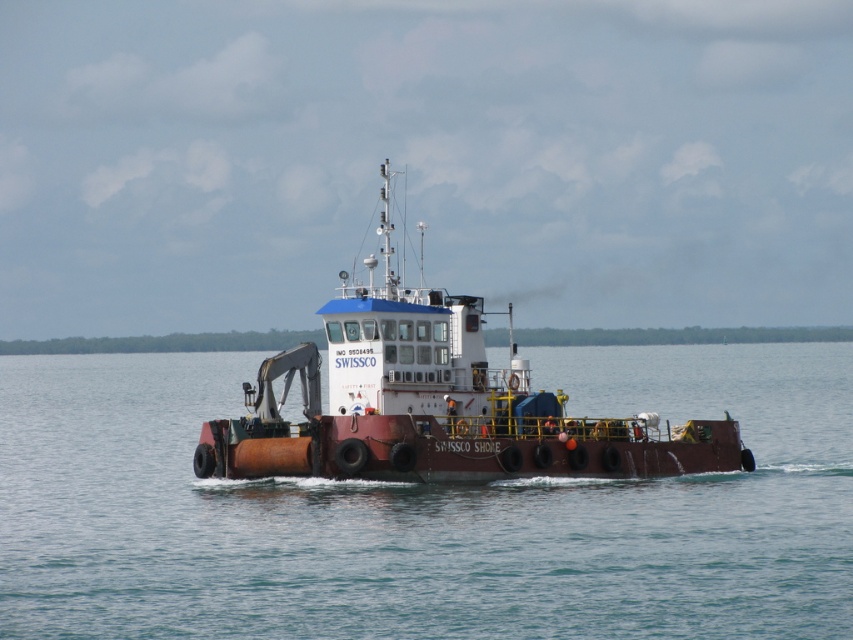
Is rusty metal water at center further to camera compared to rusty metal barge at center?

No, rusty metal water at center is in front of rusty metal barge at center.

Between rusty metal water at center and rusty metal barge at center, which one is positioned lower?

rusty metal water at center is below.

Which is behind, point (405, 579) or point (279, 364)?

Point (279, 364)

Find the location of `rusty metal water at center`. rusty metal water at center is located at coordinates (424, 513).